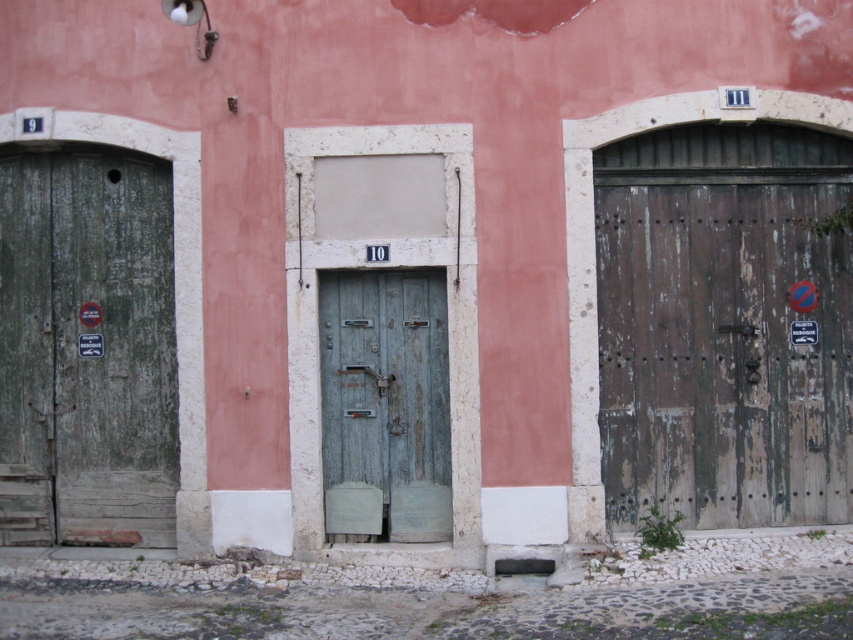
Question: Which of the following is the closest to the observer?

Choices:
 (A) (401, 420)
 (B) (115, 376)

Answer: (A)

Question: Does green weathered wood door at left appear on the left side of green weathered wood door at center?

Choices:
 (A) yes
 (B) no

Answer: (A)

Question: Which point appears closest to the camera in this image?

Choices:
 (A) (421, 440)
 (B) (0, 384)

Answer: (A)

Question: Can you confirm if green weathered wood door at left is positioned to the right of green weathered wood door at center?

Choices:
 (A) yes
 (B) no

Answer: (B)

Question: Which object is closer to the camera taking this photo?

Choices:
 (A) green weathered wood door at left
 (B) green weathered wood door at center

Answer: (B)

Question: Is green weathered wood door at left to the left of green weathered wood door at center from the viewer's perspective?

Choices:
 (A) yes
 (B) no

Answer: (A)